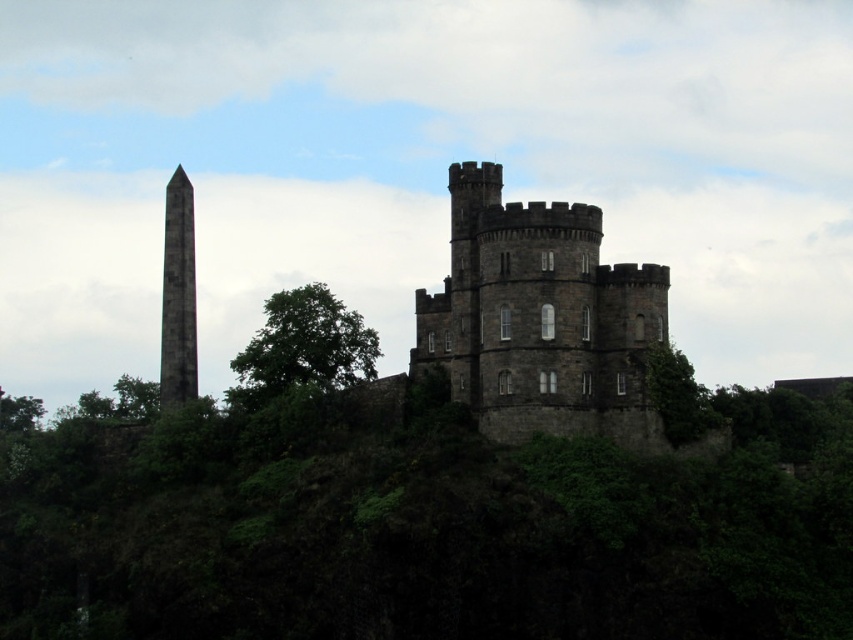
Who is lower down, dark stone castle at center or green leafy tree at right?

green leafy tree at right is lower down.

Is point (467, 182) more distant than point (701, 419)?

Yes.

Is point (548, 403) farther from camera compared to point (666, 420)?

No, (548, 403) is in front of (666, 420).

You are a GUI agent. You are given a task and a screenshot of the screen. Output one action in this format:
    pyautogui.click(x=<x>, y=<y>)
    Task: Click on the dark stone castle at center
    This screenshot has height=640, width=853.
    Given the screenshot: What is the action you would take?
    pyautogui.click(x=540, y=320)

Looking at this image, can you confirm if granite obelisk at left is positioned below green leafy tree at right?

Incorrect, granite obelisk at left is not positioned below green leafy tree at right.

Measure the distance between point (189, 364) and camera.

They are 114.95 meters apart.

You are a GUI agent. You are given a task and a screenshot of the screen. Output one action in this format:
    pyautogui.click(x=<x>, y=<y>)
    Task: Click on the granite obelisk at left
    This screenshot has width=853, height=640.
    Given the screenshot: What is the action you would take?
    pyautogui.click(x=178, y=296)

Is green leafy tree at center to the left of granite obelisk at left from the viewer's perspective?

Incorrect, green leafy tree at center is not on the left side of granite obelisk at left.

Describe the element at coordinates (302, 348) in the screenshot. The height and width of the screenshot is (640, 853). I see `green leafy tree at center` at that location.

In order to click on green leafy tree at center in this screenshot , I will do `click(302, 348)`.

This screenshot has height=640, width=853. I want to click on green leafy tree at center, so click(302, 348).